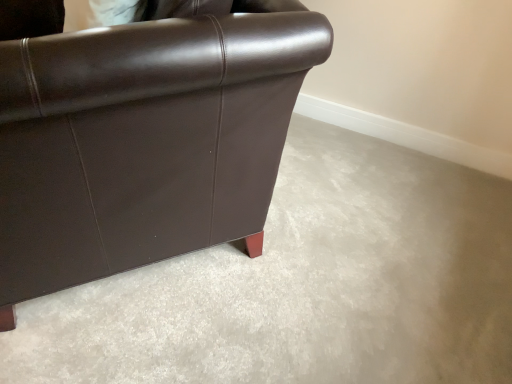
Image resolution: width=512 pixels, height=384 pixels. Describe the element at coordinates (145, 138) in the screenshot. I see `matte brown leather chair at upper left` at that location.

Find the location of `matte brown leather chair at upper left`. matte brown leather chair at upper left is located at coordinates (145, 138).

Describe the element at coordinates (305, 285) in the screenshot. I see `brown leather couch at left` at that location.

Image resolution: width=512 pixels, height=384 pixels. I want to click on brown leather couch at left, so click(305, 285).

Find the location of a particular element. matte brown leather chair at upper left is located at coordinates (145, 138).

Visually, is brown leather couch at left positioned to the left or to the right of matte brown leather chair at upper left?

From the image, it's evident that brown leather couch at left is to the right of matte brown leather chair at upper left.

Is brown leather couch at left further to camera compared to matte brown leather chair at upper left?

Yes.

Considering the positions of point (445, 327) and point (60, 56), is point (445, 327) closer or farther from the camera than point (60, 56)?

Point (445, 327) is positioned farther from the camera compared to point (60, 56).

From the image's perspective, does brown leather couch at left appear higher than matte brown leather chair at upper left?

No.

From a real-world perspective, is brown leather couch at left over matte brown leather chair at upper left?

No, from a real-world perspective, brown leather couch at left is not on top of matte brown leather chair at upper left.

Does brown leather couch at left have a greater width compared to matte brown leather chair at upper left?

Indeed, brown leather couch at left has a greater width compared to matte brown leather chair at upper left.

Between brown leather couch at left and matte brown leather chair at upper left, which one has more height?

With more height is matte brown leather chair at upper left.

Is brown leather couch at left smaller than matte brown leather chair at upper left?

Yes.

From the picture: Is brown leather couch at left inside or outside of matte brown leather chair at upper left?

brown leather couch at left lies outside matte brown leather chair at upper left.

Is brown leather couch at left next to matte brown leather chair at upper left and touching it?

They are not placed beside each other.

Looking at this image, is brown leather couch at left facing away from matte brown leather chair at upper left?

Yes.

The width and height of the screenshot is (512, 384). I want to click on concrete on the right of the matte brown leather chair at upper left, so click(305, 285).

Which object is positioned more to the left, matte brown leather chair at upper left or brown leather couch at left?

matte brown leather chair at upper left.

Is matte brown leather chair at upper left in front of or behind brown leather couch at left in the image?

matte brown leather chair at upper left is positioned closer to the viewer than brown leather couch at left.

Which is nearer, (x=188, y=178) or (x=387, y=182)?

Point (x=188, y=178) is positioned closer to the camera compared to point (x=387, y=182).

From the image's perspective, which object appears higher, matte brown leather chair at upper left or brown leather couch at left?

From the image's view, matte brown leather chair at upper left is above.

Looking at this image, from a real-world perspective, which is physically above, matte brown leather chair at upper left or brown leather couch at left?

In real-world perspective, matte brown leather chair at upper left is above.

Is matte brown leather chair at upper left thinner than brown leather couch at left?

Correct, the width of matte brown leather chair at upper left is less than that of brown leather couch at left.

Is matte brown leather chair at upper left shorter than brown leather couch at left?

In fact, matte brown leather chair at upper left may be taller than brown leather couch at left.

Is matte brown leather chair at upper left smaller than brown leather couch at left?

Incorrect, matte brown leather chair at upper left is not smaller in size than brown leather couch at left.

Which is correct: matte brown leather chair at upper left is inside brown leather couch at left, or outside of it?

matte brown leather chair at upper left is outside brown leather couch at left.

Is matte brown leather chair at upper left in contact with brown leather couch at left?

No, matte brown leather chair at upper left is not making contact with brown leather couch at left.

Is matte brown leather chair at upper left oriented away from brown leather couch at left?

Yes, matte brown leather chair at upper left is positioned with its back facing brown leather couch at left.

Can you tell me how much matte brown leather chair at upper left and brown leather couch at left differ in facing direction?

137 degrees separate the facing orientations of matte brown leather chair at upper left and brown leather couch at left.

How distant is matte brown leather chair at upper left from brown leather couch at left?

A distance of 19.02 inches exists between matte brown leather chair at upper left and brown leather couch at left.

Where is `chair that is above the brown leather couch at left (from the image's perspective)`? Image resolution: width=512 pixels, height=384 pixels. chair that is above the brown leather couch at left (from the image's perspective) is located at coordinates (145, 138).

Where is `concrete that is below the matte brown leather chair at upper left (from the image's perspective)`? The width and height of the screenshot is (512, 384). concrete that is below the matte brown leather chair at upper left (from the image's perspective) is located at coordinates (305, 285).

The width and height of the screenshot is (512, 384). In order to click on chair above the brown leather couch at left (from a real-world perspective) in this screenshot , I will do `click(145, 138)`.